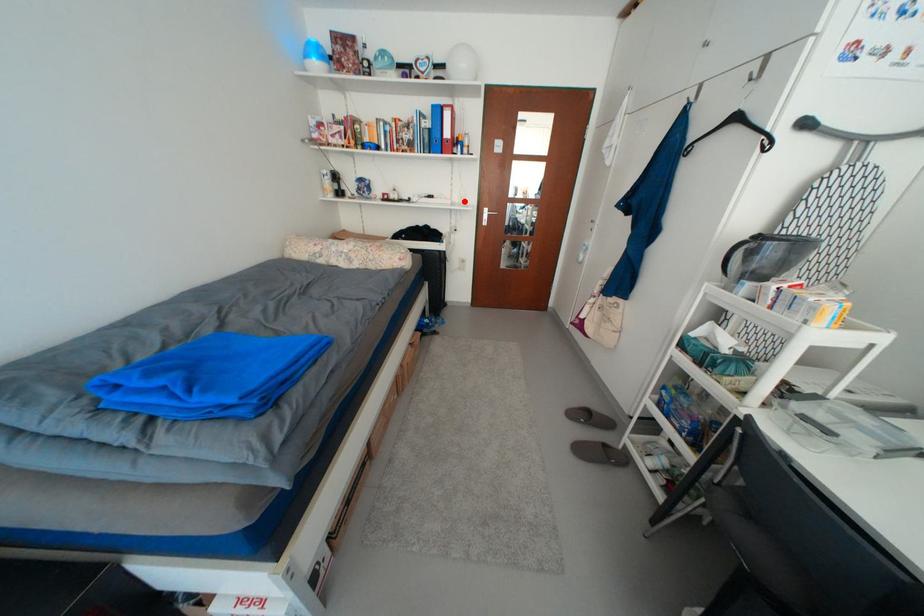
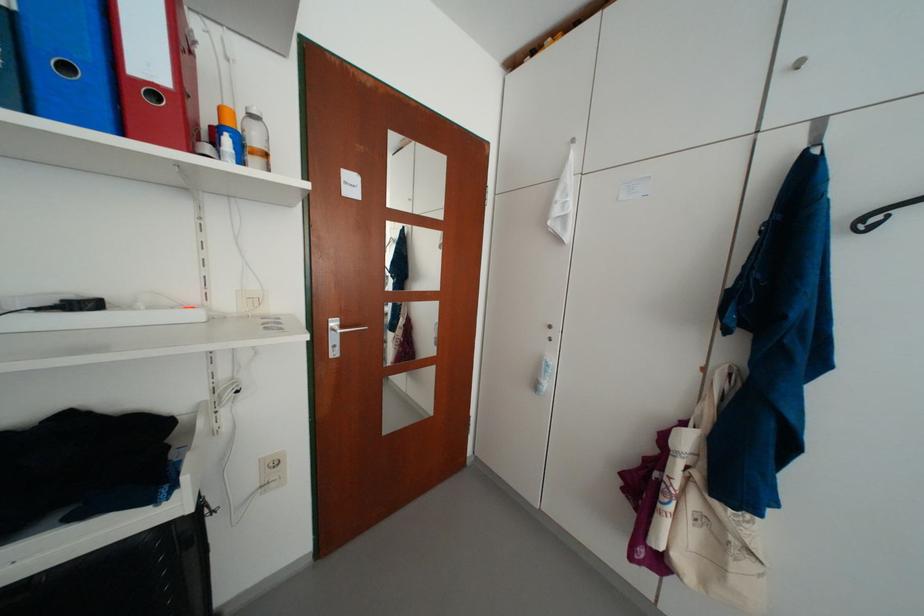
Question: I am providing you with two images of the same scene from different viewpoints. A red point is shown in image1. For the corresponding object point in image2, is it positioned nearer or farther from the camera?

Choices:
 (A) Nearer
 (B) Farther

Answer: (B)